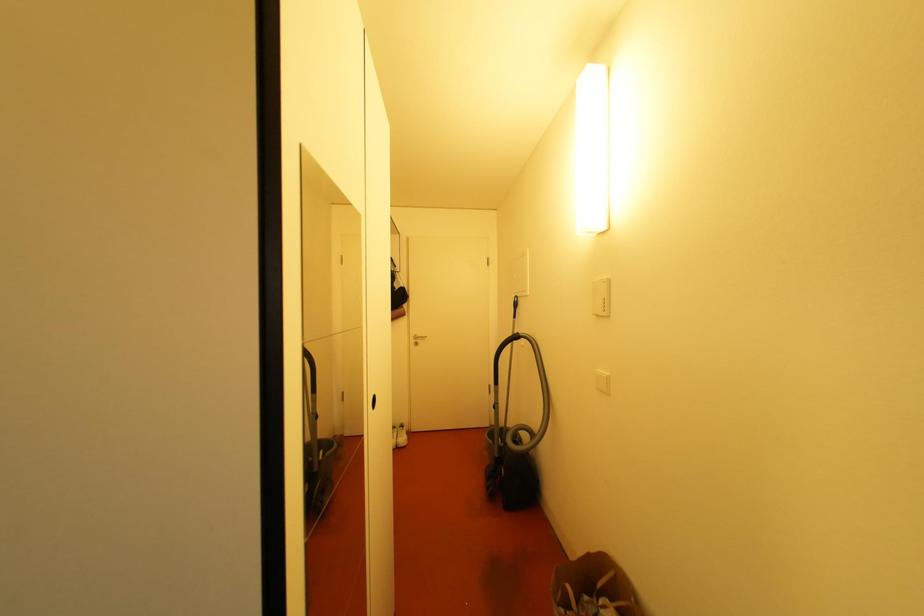
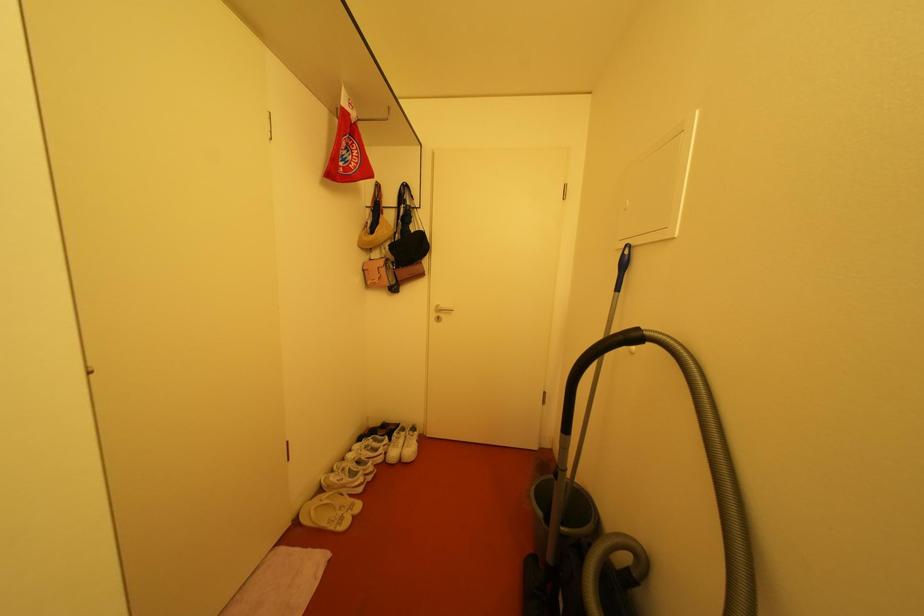
Question: What movement of the cameraman would produce the second image?

Choices:
 (A) Left
 (B) Right
 (C) Forward
 (D) Backward

Answer: (C)